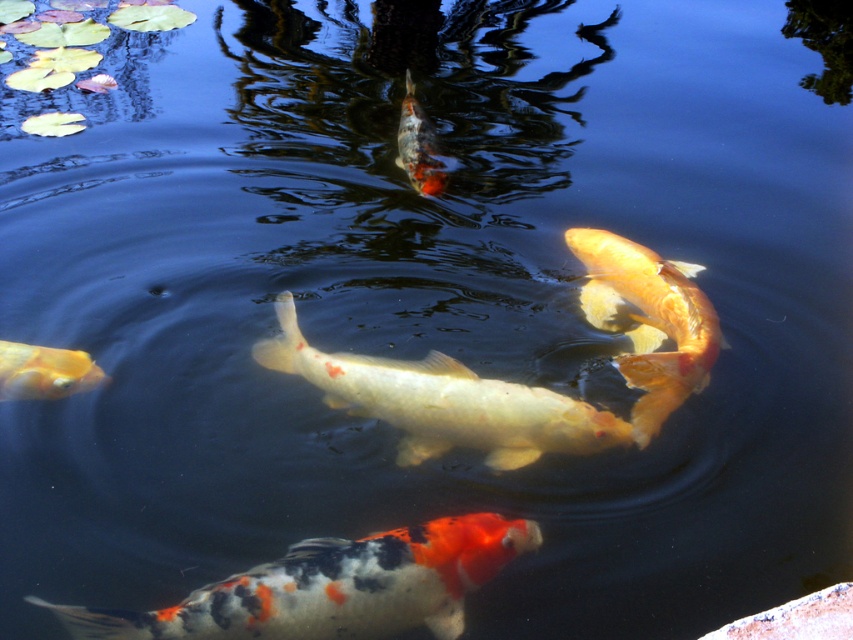
You are a photographer trying to capture a clear image of the shiny gold fish at center and the shiny orange fish at center. Which fish would appear closer to the surface of the water?

The shiny orange fish at center appears closer to the surface since the shiny gold fish at center is positioned under it.